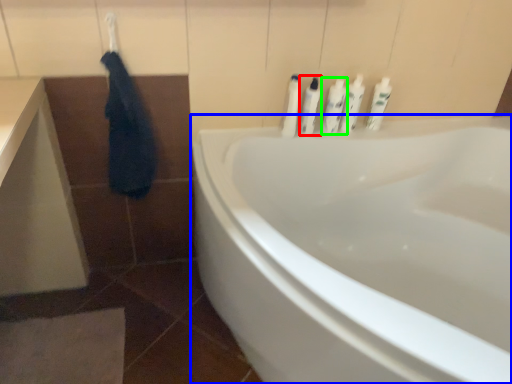
Question: Which is farther away from toiletry (highlighted by a red box)? bathtub (highlighted by a blue box) or toiletry (highlighted by a green box)?

Choices:
 (A) bathtub
 (B) toiletry

Answer: (A)